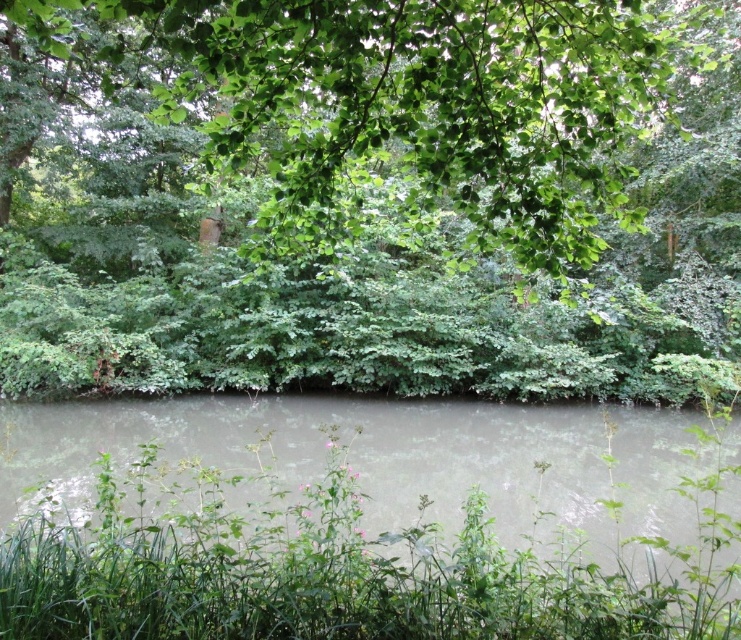
Is green leafy tree at upper center taller than gray murky water at center?

Indeed, green leafy tree at upper center has a greater height compared to gray murky water at center.

Is green leafy tree at upper center shorter than gray murky water at center?

Incorrect, green leafy tree at upper center's height does not fall short of gray murky water at center's.

Describe the element at coordinates (368, 195) in the screenshot. I see `green leafy tree at upper center` at that location.

Locate an element on the screen. Image resolution: width=741 pixels, height=640 pixels. green leafy tree at upper center is located at coordinates (368, 195).